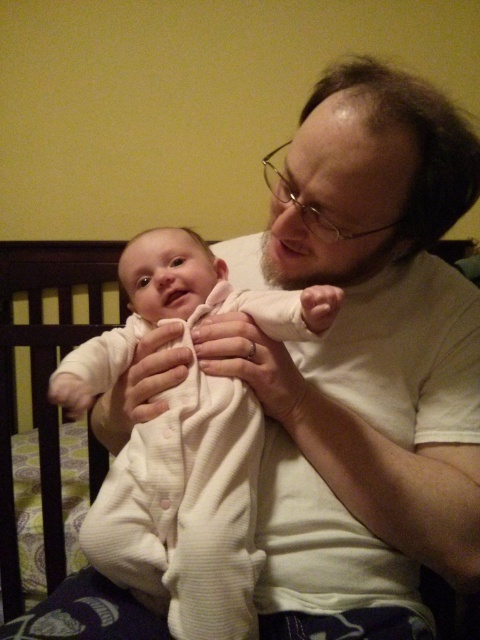
Does white ribbed onesie at center appear under white soft fabric at center?

Actually, white ribbed onesie at center is above white soft fabric at center.

What are the coordinates of `white ribbed onesie at center` in the screenshot? It's located at (187, 509).

Find the location of a particular element. The width and height of the screenshot is (480, 640). white ribbed onesie at center is located at coordinates (187, 509).